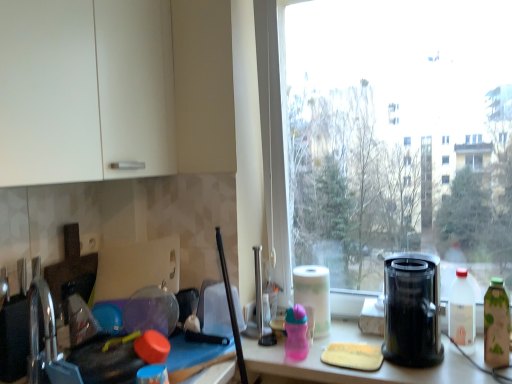
Question: Is the position of transparent glass window at center more distant than that of green matte bottle at right, which is the 3th bottle in left-to-right order?

Choices:
 (A) yes
 (B) no

Answer: (B)

Question: Does transparent glass window at center have a smaller size compared to green matte bottle at right, which is the 1th bottle from right to left?

Choices:
 (A) no
 (B) yes

Answer: (A)

Question: Does transparent glass window at center have a lesser height compared to green matte bottle at right, which is the 3th bottle in left-to-right order?

Choices:
 (A) no
 (B) yes

Answer: (A)

Question: Is green matte bottle at right, which is the 1th bottle from right to left, completely or partially inside transparent glass window at center?

Choices:
 (A) no
 (B) yes

Answer: (A)

Question: From a real-world perspective, is transparent glass window at center physically above green matte bottle at right, which is the 3th bottle in left-to-right order?

Choices:
 (A) yes
 (B) no

Answer: (A)

Question: Is transparent glass window at center not near green matte bottle at right, which is the 3th bottle in left-to-right order?

Choices:
 (A) yes
 (B) no

Answer: (A)

Question: Can black plastic juicer at right be found inside white paper at window?

Choices:
 (A) yes
 (B) no

Answer: (B)

Question: From the image's perspective, would you say white paper at window is positioned over black plastic juicer at right?

Choices:
 (A) yes
 (B) no

Answer: (B)

Question: From a real-world perspective, is white paper at window physically above black plastic juicer at right?

Choices:
 (A) no
 (B) yes

Answer: (A)

Question: Is white paper at window bigger than black plastic juicer at right?

Choices:
 (A) yes
 (B) no

Answer: (B)

Question: Is white paper at window far away from black plastic juicer at right?

Choices:
 (A) yes
 (B) no

Answer: (B)

Question: Is white paper at window aimed at black plastic juicer at right?

Choices:
 (A) yes
 (B) no

Answer: (B)

Question: Is white plastic bottle at right, which is counted as the 2th bottle, starting from the right, taller than black plastic juicer at right?

Choices:
 (A) no
 (B) yes

Answer: (A)